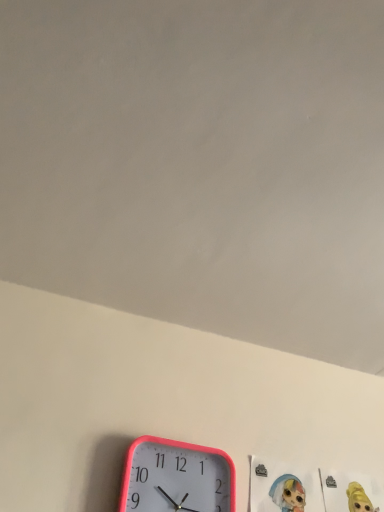
I want to click on pink plastic wall clock at lower left, so click(x=176, y=477).

What do you see at coordinates (176, 477) in the screenshot? I see `pink plastic wall clock at lower left` at bounding box center [176, 477].

Where is `pink plastic wall clock at lower left`? pink plastic wall clock at lower left is located at coordinates (176, 477).